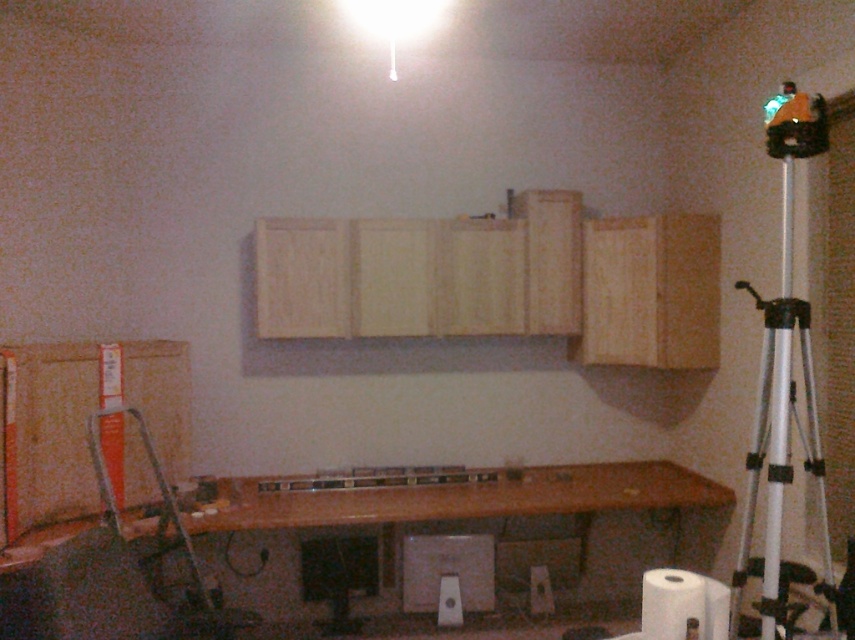
You are a construction worker standing in the room and need to reach both the wooden at lower center and the silver metallic tripod at right. Which object will you encounter first as you move forward?

You will encounter the wooden at lower center first because it is closer to you than the silver metallic tripod at right, which is further away.

You are setting up equipment in a construction site. You have a silver metallic tripod at right and a white plastic speaker at center. Which object can you place a larger item on top of without it falling over?

The silver metallic tripod at right has a larger size compared to the white plastic speaker at center, so you can place a larger item on top of the silver metallic tripod at right without it falling over.